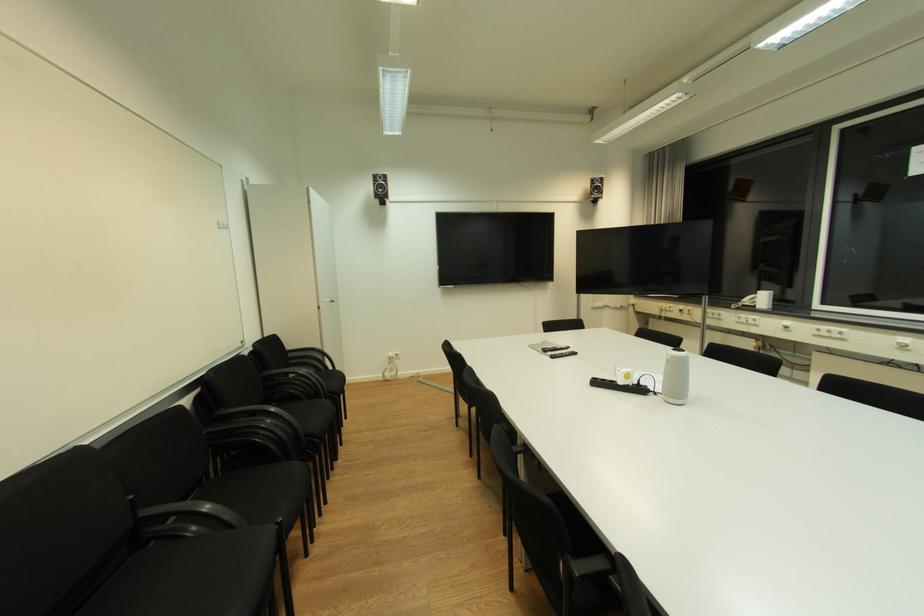
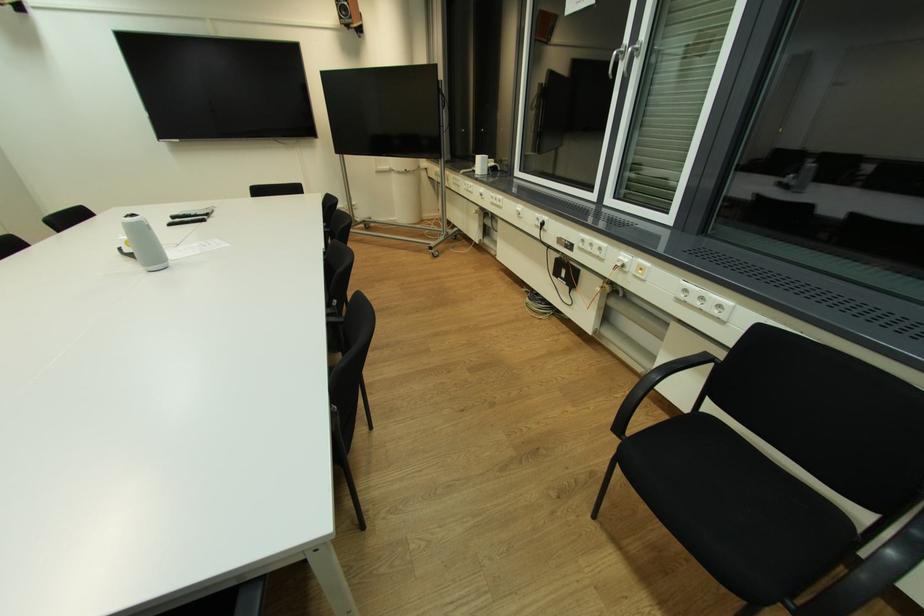
Question: In a continuous first-person perspective shot, in which direction is the camera moving?

Choices:
 (A) Left
 (B) Right
 (C) Forward
 (D) Backward

Answer: (B)